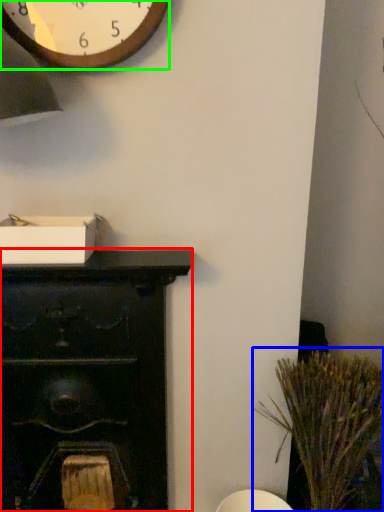
Question: Considering the real-world distances, which object is closest to furniture (highlighted by a red box)? plant (highlighted by a blue box) or wall clock (highlighted by a green box).

Choices:
 (A) plant
 (B) wall clock

Answer: (A)